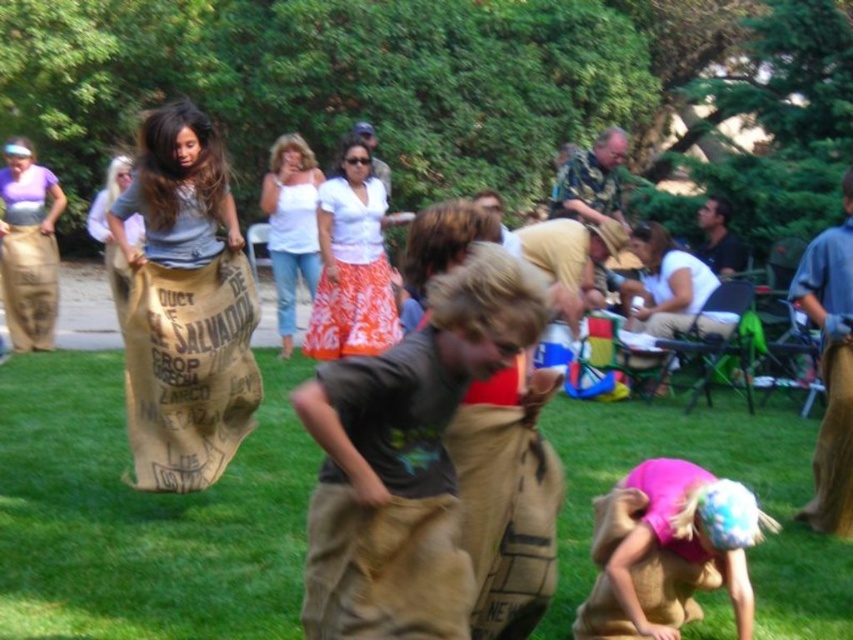
From the picture: Is green grass at lower center below pink fabric at lower right?

Yes.

Is point (820, 548) positioned after point (683, 596)?

Yes, it is behind point (683, 596).

Is point (70, 552) in front of point (668, 580)?

That is False.

You are a GUI agent. You are given a task and a screenshot of the screen. Output one action in this format:
    pyautogui.click(x=<x>, y=<y>)
    Task: Click on the green grass at lower center
    The width and height of the screenshot is (853, 640).
    Given the screenshot: What is the action you would take?
    pyautogui.click(x=142, y=515)

Is brown burlap sack at center further to the viewer compared to burlap sack at center?

No, brown burlap sack at center is closer to the viewer.

Is brown burlap sack at center smaller than burlap sack at center?

Correct, brown burlap sack at center occupies less space than burlap sack at center.

This screenshot has height=640, width=853. What do you see at coordinates (405, 458) in the screenshot?
I see `brown burlap sack at center` at bounding box center [405, 458].

Find the location of a particular element. This screenshot has height=640, width=853. brown burlap sack at center is located at coordinates (405, 458).

Does brown burlap sack at center have a greater height compared to pink fabric at lower right?

Correct, brown burlap sack at center is much taller as pink fabric at lower right.

Which of these two, brown burlap sack at center or pink fabric at lower right, stands shorter?

Standing shorter between the two is pink fabric at lower right.

Where is `brown burlap sack at center`? Image resolution: width=853 pixels, height=640 pixels. brown burlap sack at center is located at coordinates (405, 458).